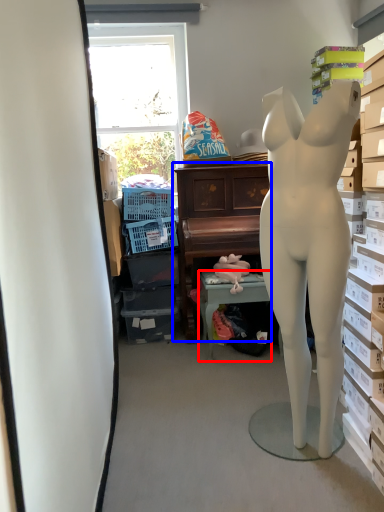
Question: Which of the following is the farthest to the observer, table (highlighted by a red box) or furniture (highlighted by a blue box)?

Choices:
 (A) table
 (B) furniture

Answer: (B)